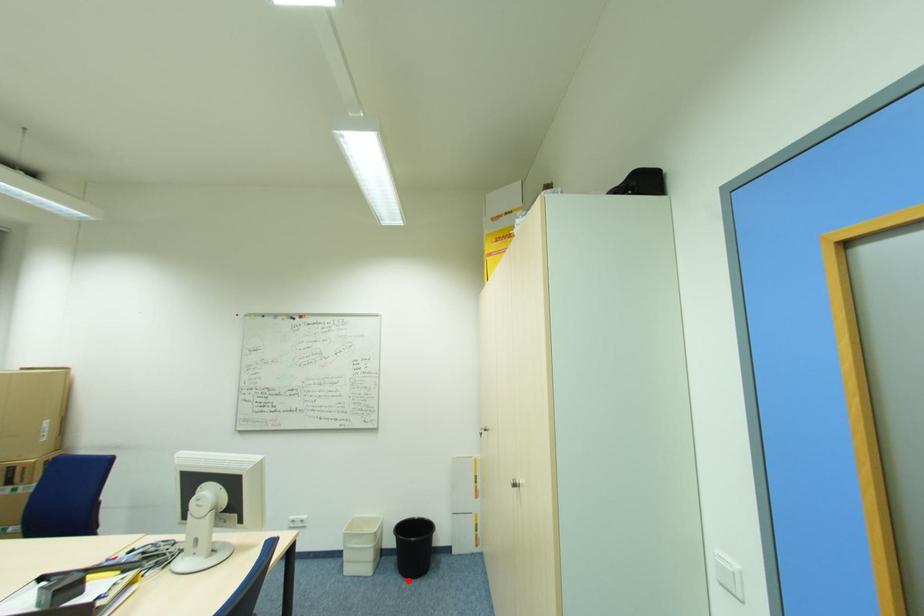
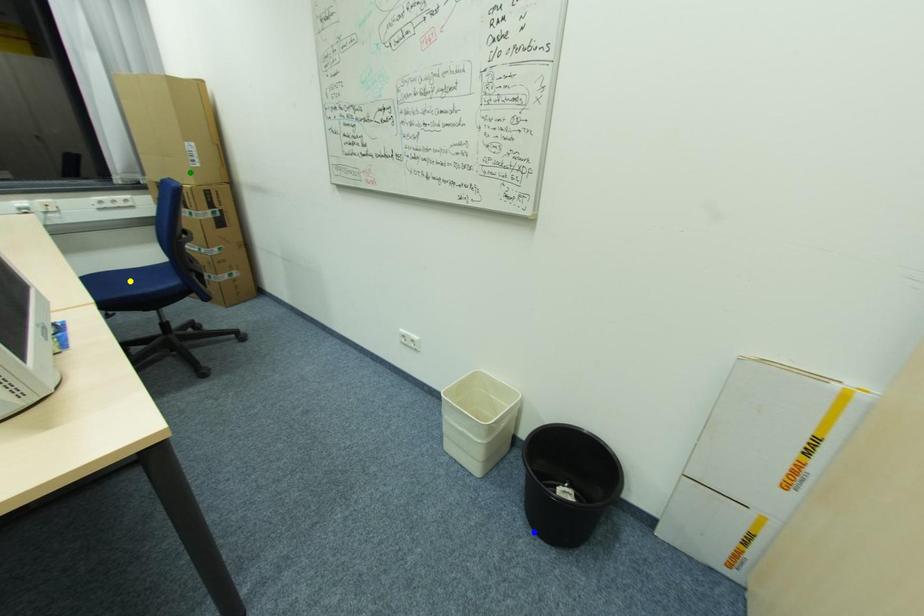
Question: I am providing you with two images of the same scene from different viewpoints. A red point is marked on the first image. You are given multiple points on the second image. Can you choose the point in image 2 that corresponds to the point in image 1?

Choices:
 (A) blue point
 (B) green point
 (C) yellow point

Answer: (A)